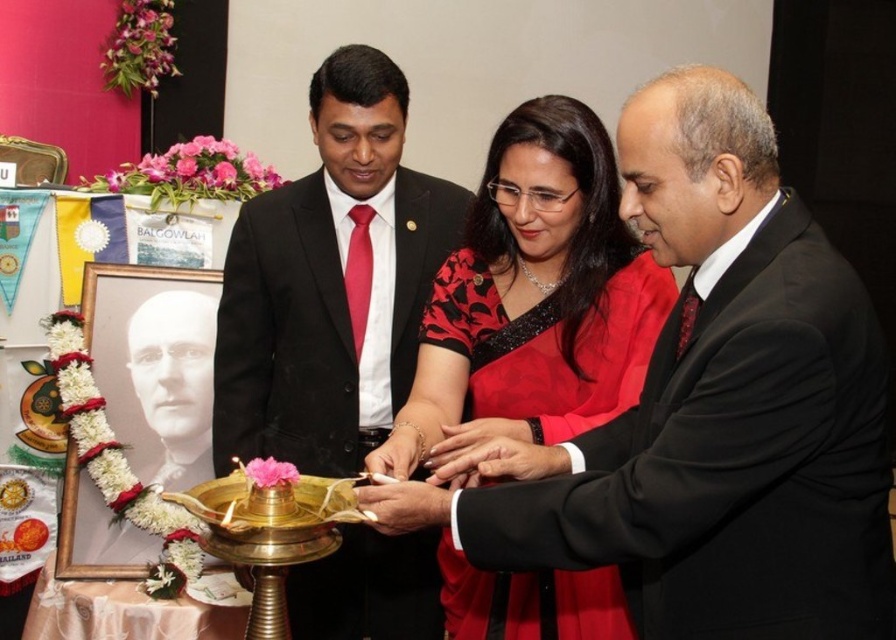
You are an event planner organizing a photo shoot for the formal event. You need to decide which item takes up more space in the frame. Which one is larger between the black satin saree at center and the black glossy portrait at left?

The black satin saree at center is bigger than the black glossy portrait at left, so the black satin saree at center takes up more space in the frame.

You are attending a formal event and see two people at the center of the scene. Which one is on the left side, the person wearing the matte black suit at center or the one in the black satin saree at center?

The matte black suit at center is positioned on the left side of the black satin saree at center.

You are a photographer at the event and need to adjust the lighting so that both the matte black suit at center and the black satin saree at center are equally visible. Since one is taller than the other, how should you position the lights to ensure both are illuminated properly?

The matte black suit at center is taller than the black satin saree at center. To ensure both are equally visible, position the lights so that they illuminate the taller matte black suit at center from above and the shorter black satin saree at center from the front to balance their visibility.